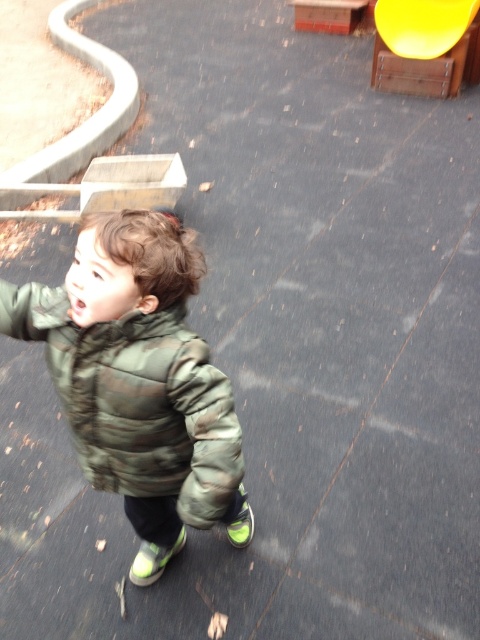
Between camouflage quilted jacket at center and yellow plastic slide at upper right, which one appears on the left side from the viewer's perspective?

camouflage quilted jacket at center is more to the left.

Does camouflage quilted jacket at center have a greater height compared to yellow plastic slide at upper right?

No, camouflage quilted jacket at center is not taller than yellow plastic slide at upper right.

Is point (131, 413) farther from camera compared to point (427, 32)?

No, it is in front of (427, 32).

Find the location of a particular element. The height and width of the screenshot is (640, 480). camouflage quilted jacket at center is located at coordinates (137, 401).